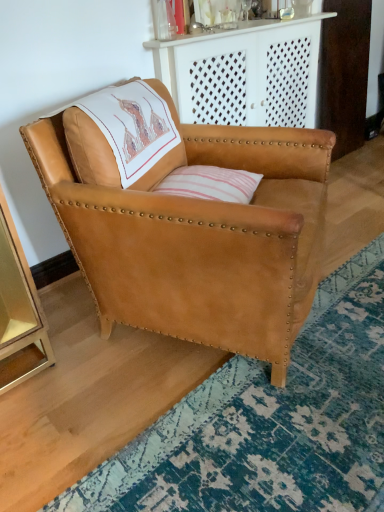
Describe the element at coordinates (193, 232) in the screenshot. I see `tan leather chair at center` at that location.

Find the location of `tan leather chair at center`. tan leather chair at center is located at coordinates (193, 232).

Measure the distance between tan leather chair at center and camera.

The depth of tan leather chair at center is 3.34 feet.

In the scene shown: Measure the distance between point (229, 261) and camera.

A distance of 3.75 feet exists between point (229, 261) and camera.

Identify the location of tan leather chair at center. The height and width of the screenshot is (512, 384). (193, 232).